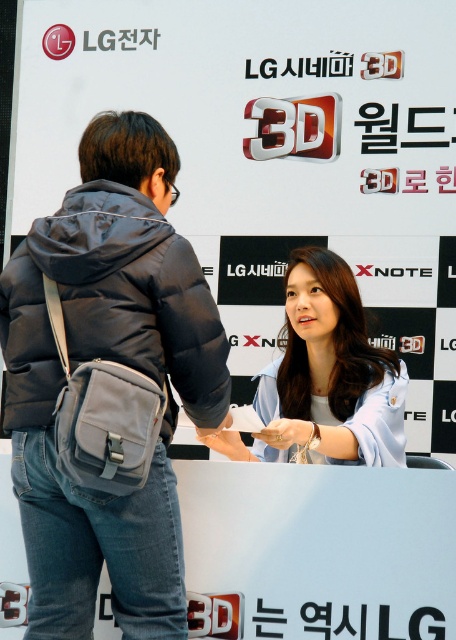
Question: Which point is closer to the camera?

Choices:
 (A) dark gray puffer jacket at center
 (B) satin white wristband at lower center
 (C) light blue fabric shirt at center

Answer: (A)

Question: Which object is farther from the camera taking this photo?

Choices:
 (A) light blue fabric shirt at center
 (B) dark gray puffer jacket at center
 (C) white matte hand at center
 (D) denim jacket at center

Answer: (A)

Question: Is white matte hand at center further to camera compared to satin white wristband at lower center?

Choices:
 (A) yes
 (B) no

Answer: (B)

Question: Considering the relative positions of light blue fabric shirt at center and white matte hand at center in the image provided, where is light blue fabric shirt at center located with respect to white matte hand at center?

Choices:
 (A) right
 (B) left

Answer: (A)

Question: Which point is closer to the camera?

Choices:
 (A) dark gray puffer jacket at center
 (B) denim jacket at center

Answer: (B)

Question: Is light blue fabric shirt at center below satin white wristband at lower center?

Choices:
 (A) no
 (B) yes

Answer: (A)